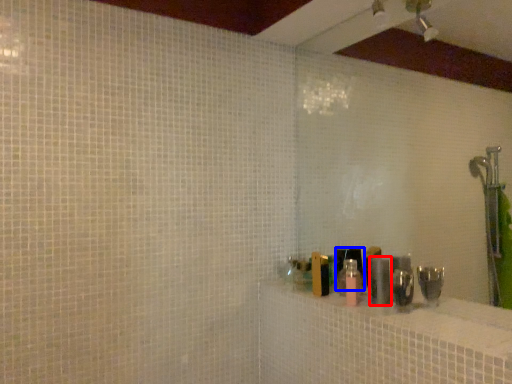
Question: Which of the following is the farthest to the observer, toiletry (highlighted by a red box) or toiletry (highlighted by a blue box)?

Choices:
 (A) toiletry
 (B) toiletry

Answer: (A)